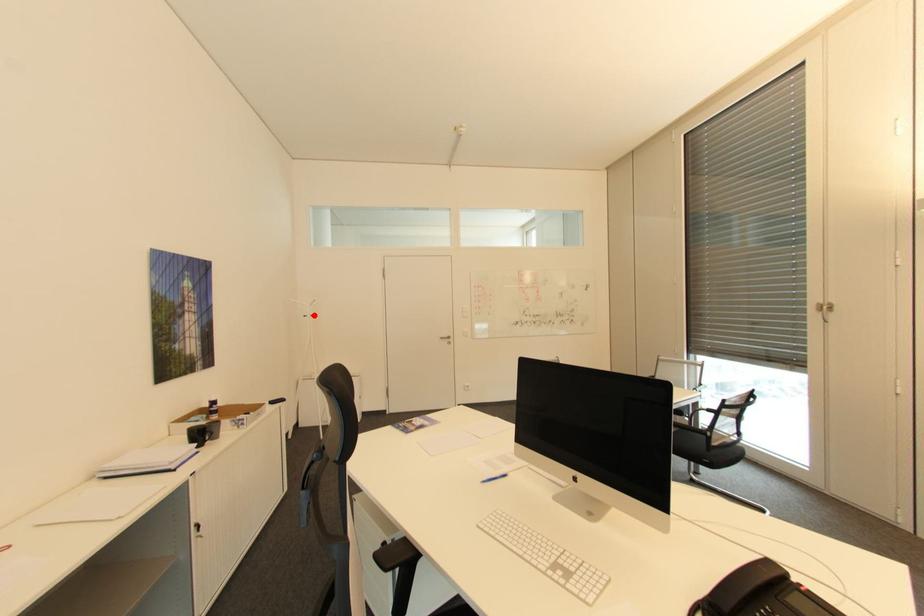
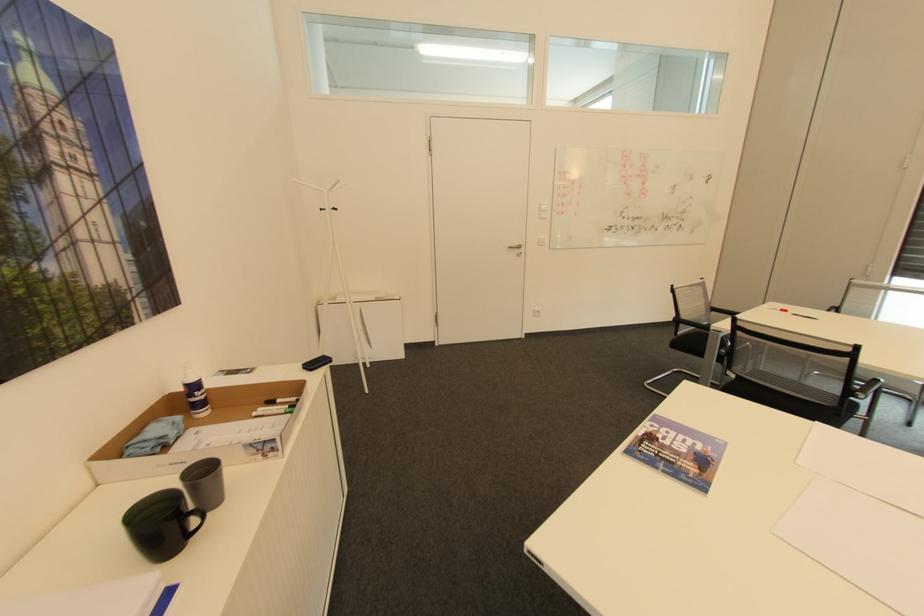
In the second image, find the point that corresponds to the highlighted location in the first image.

(333, 208)